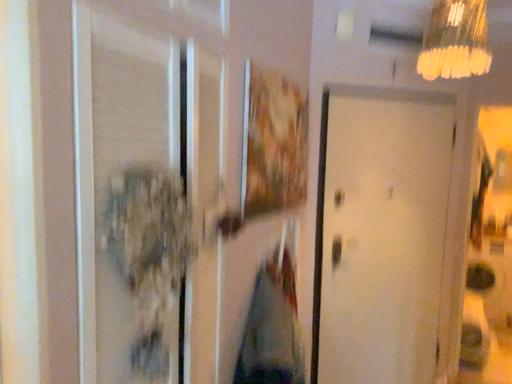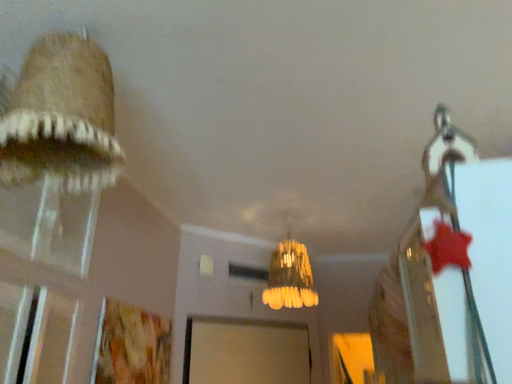
Question: Which way did the camera rotate in the video?

Choices:
 (A) rotated right
 (B) rotated left

Answer: (A)